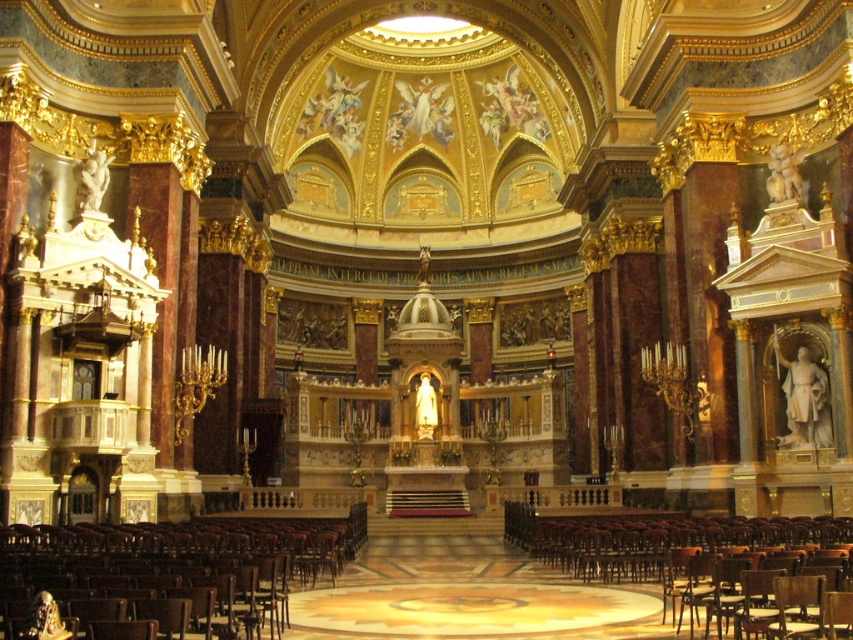
Does wooden polished chair at lower left have a greater height compared to wooden polished chair at lower right?

Incorrect, wooden polished chair at lower left's height is not larger of wooden polished chair at lower right's.

Is point (215, 552) farther from camera compared to point (730, 614)?

That is True.

Describe the element at coordinates (181, 563) in the screenshot. I see `wooden polished chair at lower left` at that location.

At what (x,y) coordinates should I click in order to perform the action: click on wooden polished chair at lower left. Please return your answer as a coordinate pair (x, y). Image resolution: width=853 pixels, height=640 pixels. Looking at the image, I should click on (181, 563).